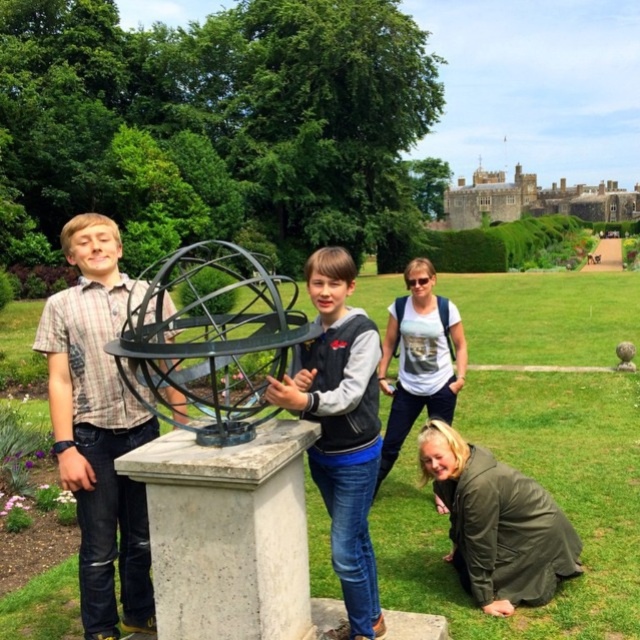
You are standing in the park and want to take a photo of the black metal sphere at center and the green matte jacket at lower right. Which object should you aim your camera towards first if you want to capture both in the same frame without moving the camera?

You should aim your camera towards the black metal sphere at center first because it is to the left of the green matte jacket at lower right, so capturing it first ensures both objects are within the frame without needing to reposition the camera.

You are standing in the park and want to take a photo of the sculpture. You notice two points marked on the ground at coordinates point (554, 291) and point (390, 340). Which point is closer to the camera so that it can be clearly visible in the photo?

Point (554, 291) is further to the camera than point (390, 340), so the point closer to the camera is point (390, 340) and will be more clearly visible in the photo.